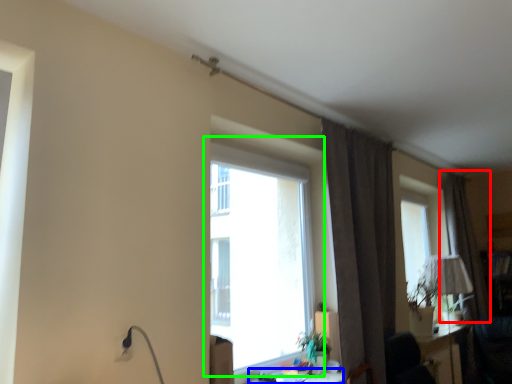
Question: Estimate the real-world distances between objects in this image. Which object is farther from curtain (highlighted by a red box), table (highlighted by a blue box) or window (highlighted by a green box)?

Choices:
 (A) table
 (B) window

Answer: (A)